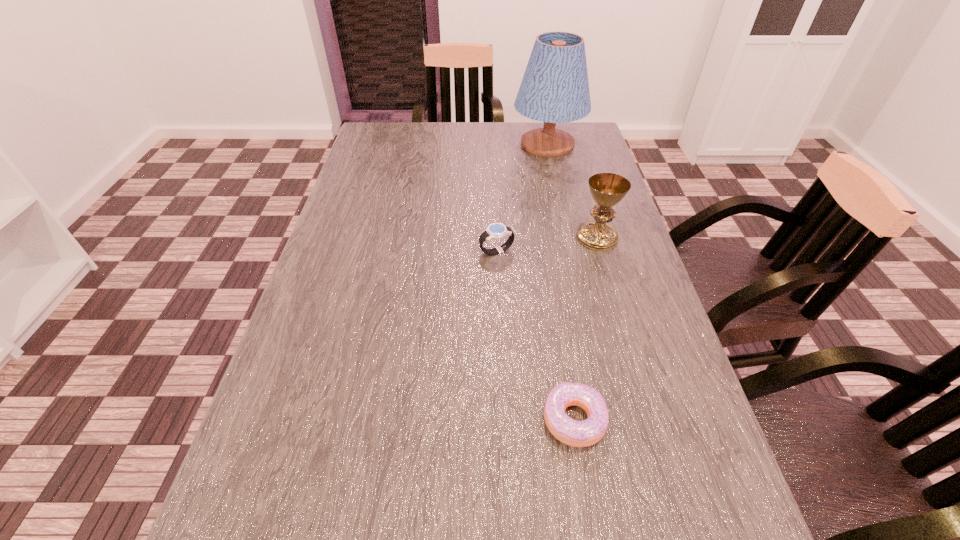
Find the location of a particular element. lampshade is located at coordinates (555, 89).

Where is `the farthest object`? the farthest object is located at coordinates (555, 89).

At what (x,y) coordinates should I click in order to perform the action: click on chalice. Please return your answer as a coordinate pair (x, y). This screenshot has width=960, height=540. Looking at the image, I should click on (607, 189).

The image size is (960, 540). Identify the location of the second shortest object. pyautogui.click(x=496, y=231).

You are a GUI agent. You are given a task and a screenshot of the screen. Output one action in this format:
    pyautogui.click(x=<x>, y=<y>)
    Task: Click on the leftmost object
    Image resolution: width=960 pixels, height=540 pixels.
    Given the screenshot: What is the action you would take?
    pyautogui.click(x=496, y=231)

Where is `the nearest object`? the nearest object is located at coordinates (571, 432).

Find the location of a particular element. Image resolution: width=960 pixels, height=540 pixels. the shortest object is located at coordinates (571, 432).

Where is `free space located on the front of the lampshade`? The height and width of the screenshot is (540, 960). free space located on the front of the lampshade is located at coordinates (570, 246).

Where is `vacant space located 0.130m on the left of the chalice`? The width and height of the screenshot is (960, 540). vacant space located 0.130m on the left of the chalice is located at coordinates (525, 238).

Find the location of `vacant space located on the front of the leftmost object`. vacant space located on the front of the leftmost object is located at coordinates (497, 274).